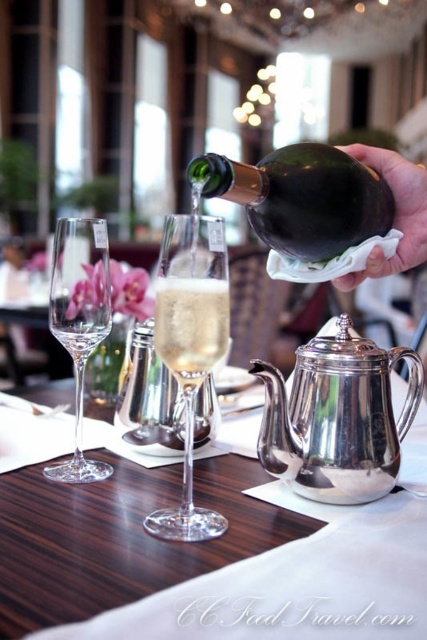
From the picture: You are a server at the restaurant and need to place a napkin on the table. The napkin is 10 cm in diameter. The table is 120 cm long and 60 cm wide. The point at coordinates (190, 346) marks the center of the clear glass wine glass at center. If you want to place the napkin so that it doesn

The point at coordinates (190, 346) marks the center of the clear glass wine glass at center. To ensure the napkin doesn

You are a photographer setting up for a product shoot. You have two points marked on the table where you need to place two identical champagne flutes. The first point is at coordinate point(395, 472) and the second at point(175, 240). Based on the scene description, which point is closer to the camera?

Point(395, 472) is further to the camera than point(175, 240). Therefore, point(175, 240) is closer to the camera.